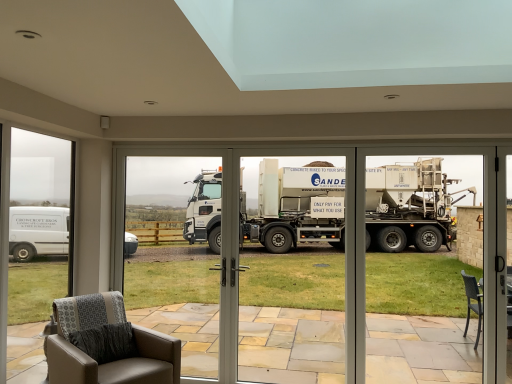
Image resolution: width=512 pixels, height=384 pixels. In order to click on transparent glass door at center in this screenshot , I will do `click(164, 233)`.

Describe the element at coordinates (111, 360) in the screenshot. I see `leather armchair at lower left` at that location.

Locate an element on the screen. The width and height of the screenshot is (512, 384). clear glass window at left is located at coordinates (39, 224).

Is white glossy truck at center, which ranks as the first garage door in right-to-left order, far from transparent glass door at center?

Indeed, white glossy truck at center, which ranks as the first garage door in right-to-left order, is not near transparent glass door at center.

Considering the sizes of objects white glossy truck at center, which ranks as the first garage door in right-to-left order, and transparent glass door at center in the image provided, who is shorter, white glossy truck at center, which ranks as the first garage door in right-to-left order, or transparent glass door at center?

white glossy truck at center, which ranks as the first garage door in right-to-left order, is shorter.

Which is more distant, (215, 217) or (129, 186)?

Point (129, 186)

From a real-world perspective, is white glossy truck at center, which ranks as the first garage door in right-to-left order, beneath transparent glass door at center?

Yes, from a real-world perspective, white glossy truck at center, which ranks as the first garage door in right-to-left order, is below transparent glass door at center.

Is point (59, 262) behind point (157, 378)?

Yes.

From the image's perspective, is clear glass window at left above or below leather armchair at lower left?

Based on their image positions, clear glass window at left is located above leather armchair at lower left.

Is clear glass window at left facing away from leather armchair at lower left?

That's not correct — clear glass window at left is not looking away from leather armchair at lower left.

Looking at this image, would you say white matte truck at center, placed as the 1th garage door when sorted from left to right, is outside transparent glass door at center?

Indeed, white matte truck at center, placed as the 1th garage door when sorted from left to right, is completely outside transparent glass door at center.

From a real-world perspective, who is located lower, white matte truck at center, placed as the 1th garage door when sorted from left to right, or transparent glass door at center?

From a 3D spatial view, transparent glass door at center is below.

From the image's perspective, does white matte truck at center, placed as the 1th garage door when sorted from left to right, appear lower than transparent glass door at center?

Yes, from the image's perspective, white matte truck at center, placed as the 1th garage door when sorted from left to right, is below transparent glass door at center.

Is white matte truck at center, placed as the 1th garage door when sorted from left to right, oriented away from transparent glass door at center?

A: No, white matte truck at center, placed as the 1th garage door when sorted from left to right, is not facing the opposite direction of transparent glass door at center.

Is transparent glass door at center not near leather armchair at lower left?

Yes.

Does transparent glass door at center contain leather armchair at lower left?

No, leather armchair at lower left is not inside transparent glass door at center.

From a real-world perspective, is transparent glass door at center on top of leather armchair at lower left?

Yes, from a real-world perspective, transparent glass door at center is above leather armchair at lower left.

Is transparent glass door at center facing towards leather armchair at lower left?

Yes, transparent glass door at center is aimed at leather armchair at lower left.

From the image's perspective, which one is positioned higher, leather armchair at lower left or clear glass window at left?

clear glass window at left, from the image's perspective.

Between leather armchair at lower left and clear glass window at left, which one has more height?

clear glass window at left.

Between leather armchair at lower left and clear glass window at left, which one has larger width?

With larger width is leather armchair at lower left.

Between point (62, 377) and point (57, 258), which one is positioned in front?

The point (62, 377) is closer.

Measure the distance from white glossy truck at center, which is the second garage door in left-to-right order, to clear glass window at left.

white glossy truck at center, which is the second garage door in left-to-right order, is 3.36 meters from clear glass window at left.

In terms of size, does white glossy truck at center, which ranks as the first garage door in right-to-left order, appear bigger or smaller than clear glass window at left?

In the image, white glossy truck at center, which ranks as the first garage door in right-to-left order, appears to be larger than clear glass window at left.

How many degrees apart are the facing directions of white glossy truck at center, which ranks as the first garage door in right-to-left order, and clear glass window at left?

The angular difference between white glossy truck at center, which ranks as the first garage door in right-to-left order, and clear glass window at left is 89.4 degrees.

Based on the photo, from the image's perspective, which is above, white glossy truck at center, which ranks as the first garage door in right-to-left order, or clear glass window at left?

clear glass window at left is shown above in the image.

Is white glossy truck at center, which ranks as the first garage door in right-to-left order, oriented towards leather armchair at lower left?

Yes.

From the image's perspective, between white glossy truck at center, which ranks as the first garage door in right-to-left order, and leather armchair at lower left, which one is located above?

white glossy truck at center, which ranks as the first garage door in right-to-left order, is shown above in the image.

Can you confirm if white glossy truck at center, which is the second garage door in left-to-right order, is wider than leather armchair at lower left?

In fact, white glossy truck at center, which is the second garage door in left-to-right order, might be narrower than leather armchair at lower left.

Between point (312, 161) and point (65, 361), which one is positioned in front?

Positioned in front is point (65, 361).

This screenshot has height=384, width=512. Identify the location of window screen above the white glossy truck at center, which ranks as the first garage door in right-to-left order (from the image's perspective). click(164, 233).

I want to click on chair in front of the clear glass window at left, so click(x=111, y=360).

Estimate the real-world distances between objects in this image. Which object is closer to leather armchair at lower left, white glossy truck at center, which ranks as the first garage door in right-to-left order, or transparent glass door at center?

Among the two, white glossy truck at center, which ranks as the first garage door in right-to-left order, is located nearer to leather armchair at lower left.

Looking at the image, which one is located closer to white glossy truck at center, which ranks as the first garage door in right-to-left order, white matte truck at center, placed as the 1th garage door when sorted from left to right, or clear glass window at left?

Among the two, white matte truck at center, placed as the 1th garage door when sorted from left to right, is located nearer to white glossy truck at center, which ranks as the first garage door in right-to-left order.

Looking at the image, which one is located further to leather armchair at lower left, white glossy truck at center, which is the second garage door in left-to-right order, or white matte truck at center, the 2th garage door viewed from the right?

white matte truck at center, the 2th garage door viewed from the right, lies further to leather armchair at lower left than the other object.

Looking at the image, which one is located further to white matte truck at center, the 2th garage door viewed from the right, clear glass window at left or leather armchair at lower left?

Among the two, leather armchair at lower left is located further to white matte truck at center, the 2th garage door viewed from the right.

Based on their spatial positions, is white matte truck at center, the 2th garage door viewed from the right, or leather armchair at lower left further from white glossy truck at center, which is the second garage door in left-to-right order?

white matte truck at center, the 2th garage door viewed from the right, lies further to white glossy truck at center, which is the second garage door in left-to-right order, than the other object.

When comparing their distances from leather armchair at lower left, does clear glass window at left or transparent glass door at center seem further?

transparent glass door at center is positioned further to the anchor leather armchair at lower left.

Considering their positions, is leather armchair at lower left positioned closer to transparent glass door at center than clear glass window at left?

Among the two, clear glass window at left is located nearer to transparent glass door at center.

Based on their spatial positions, is clear glass window at left or leather armchair at lower left further from transparent glass door at center?

Based on the image, leather armchair at lower left appears to be further to transparent glass door at center.

In order to click on window screen between leather armchair at lower left and white glossy truck at center, which is the second garage door in left-to-right order, in the horizontal direction in this screenshot , I will do `click(164, 233)`.

Image resolution: width=512 pixels, height=384 pixels. In order to click on window screen between clear glass window at left and white glossy truck at center, which is the second garage door in left-to-right order in this screenshot , I will do `click(164, 233)`.

Where is `window frame between leather armchair at lower left and transparent glass door at center along the z-axis`? Image resolution: width=512 pixels, height=384 pixels. window frame between leather armchair at lower left and transparent glass door at center along the z-axis is located at coordinates (39, 224).

Find the location of `chair between clear glass window at left and white glossy truck at center, which is the second garage door in left-to-right order`. chair between clear glass window at left and white glossy truck at center, which is the second garage door in left-to-right order is located at coordinates (111, 360).